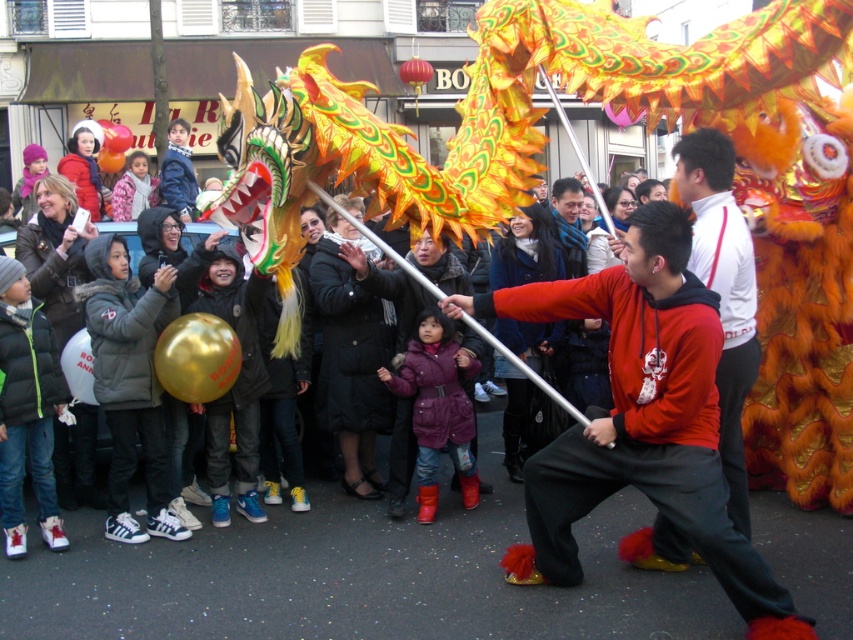
Question: Among these points, which one is farthest from the camera?

Choices:
 (A) (654, 468)
 (B) (730, 296)

Answer: (B)

Question: Is matte red sweatshirt at center thinner than red hoodie at center?

Choices:
 (A) no
 (B) yes

Answer: (A)

Question: Does matte red sweatshirt at center lie in front of red hoodie at center?

Choices:
 (A) no
 (B) yes

Answer: (B)

Question: Does matte red sweatshirt at center appear under red hoodie at center?

Choices:
 (A) no
 (B) yes

Answer: (B)